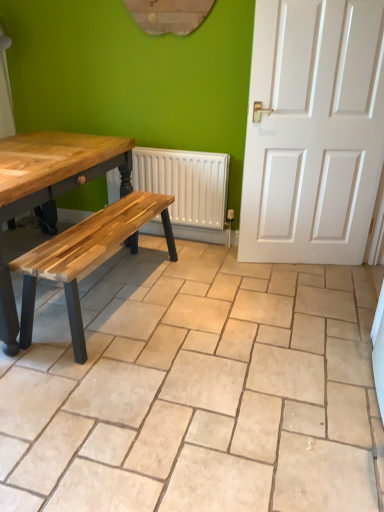
Question: In terms of height, does beige ceramic tile at center look taller or shorter compared to white textured radiator at center?

Choices:
 (A) short
 (B) tall

Answer: (A)

Question: From a real-world perspective, relative to white textured radiator at center, is beige ceramic tile at center vertically above or below?

Choices:
 (A) above
 (B) below

Answer: (B)

Question: From the image's perspective, is beige ceramic tile at center above or below white textured radiator at center?

Choices:
 (A) below
 (B) above

Answer: (A)

Question: From a real-world perspective, is white textured radiator at center above or below beige ceramic tile at center?

Choices:
 (A) below
 (B) above

Answer: (B)

Question: Relative to beige ceramic tile at center, is white textured radiator at center in front or behind?

Choices:
 (A) front
 (B) behind

Answer: (B)

Question: In terms of height, does white textured radiator at center look taller or shorter compared to beige ceramic tile at center?

Choices:
 (A) short
 (B) tall

Answer: (B)

Question: Is white textured radiator at center situated inside beige ceramic tile at center or outside?

Choices:
 (A) outside
 (B) inside

Answer: (A)